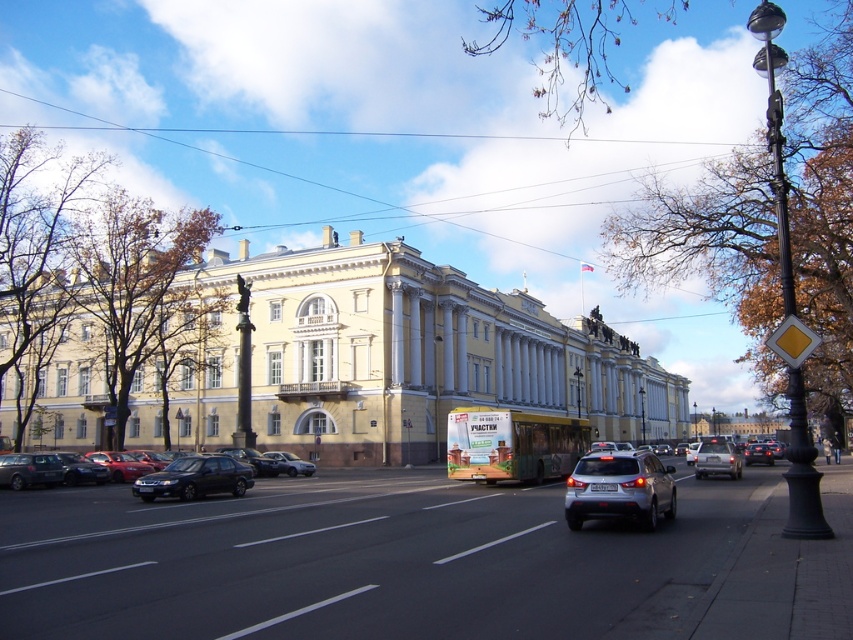
Does matte black sedan at lower left appear over satin black sedan at center?

Actually, matte black sedan at lower left is below satin black sedan at center.

You are a GUI agent. You are given a task and a screenshot of the screen. Output one action in this format:
    pyautogui.click(x=<x>, y=<y>)
    Task: Click on the matte black sedan at lower left
    Image resolution: width=853 pixels, height=640 pixels.
    Given the screenshot: What is the action you would take?
    pyautogui.click(x=193, y=477)

Describe the element at coordinates (193, 477) in the screenshot. This screenshot has height=640, width=853. I see `matte black sedan at lower left` at that location.

I want to click on matte black sedan at lower left, so click(193, 477).

Does yellow stone building at center have a smaller size compared to satin silver suv at center?

Incorrect, yellow stone building at center is not smaller in size than satin silver suv at center.

Is point (151, 417) positioned behind point (648, 464)?

Yes, it is.

Does point (309, 280) lie behind point (614, 465)?

Yes, it is.

Where is `yellow stone building at center`? Image resolution: width=853 pixels, height=640 pixels. yellow stone building at center is located at coordinates (357, 362).

Which is more to the right, yellow stone building at center or matte black sedan at lower left?

yellow stone building at center

Measure the distance between yellow stone building at center and camera.

44.66 meters

Measure the distance between point (x=128, y=422) and camera.

Point (x=128, y=422) and camera are 269.40 feet apart from each other.

At what (x,y) coordinates should I click in order to perform the action: click on yellow stone building at center. Please return your answer as a coordinate pair (x, y). Looking at the image, I should click on (357, 362).